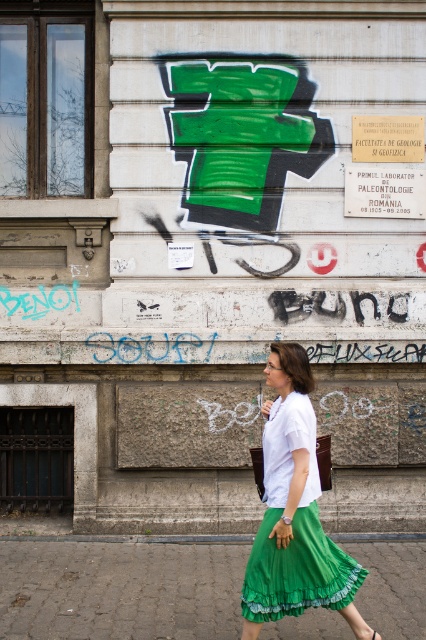
Does point (3, 582) come behind point (365, 637)?

Yes, it is behind point (365, 637).

Consider the image. Who is lower down, gray cobblestone pavement at lower center or green fabric sandal at lower center?

gray cobblestone pavement at lower center

Identify the location of gray cobblestone pavement at lower center. The image size is (426, 640). (120, 589).

This screenshot has height=640, width=426. I want to click on gray cobblestone pavement at lower center, so click(x=120, y=589).

Which of these two, gray cobblestone pavement at lower center or green satin skirt at center, stands taller?

green satin skirt at center

Where is `gray cobblestone pavement at lower center`? Image resolution: width=426 pixels, height=640 pixels. gray cobblestone pavement at lower center is located at coordinates (120, 589).

Is point (178, 572) more distant than point (270, 385)?

Yes.

Find the location of a particular element. This screenshot has height=640, width=426. gray cobblestone pavement at lower center is located at coordinates (120, 589).

Can you confirm if green satin skirt at center is positioned above green fabric sandal at lower center?

Indeed, green satin skirt at center is positioned over green fabric sandal at lower center.

Consider the image. Which of these two, green satin skirt at center or green fabric sandal at lower center, stands shorter?

With less height is green fabric sandal at lower center.

Between point (264, 464) and point (360, 630), which one is positioned in front?

Positioned in front is point (360, 630).

You are a GUI agent. You are given a task and a screenshot of the screen. Output one action in this format:
    pyautogui.click(x=<x>, y=<y>)
    Task: Click on the green satin skirt at center
    This screenshot has height=640, width=426.
    Given the screenshot: What is the action you would take?
    pyautogui.click(x=293, y=509)